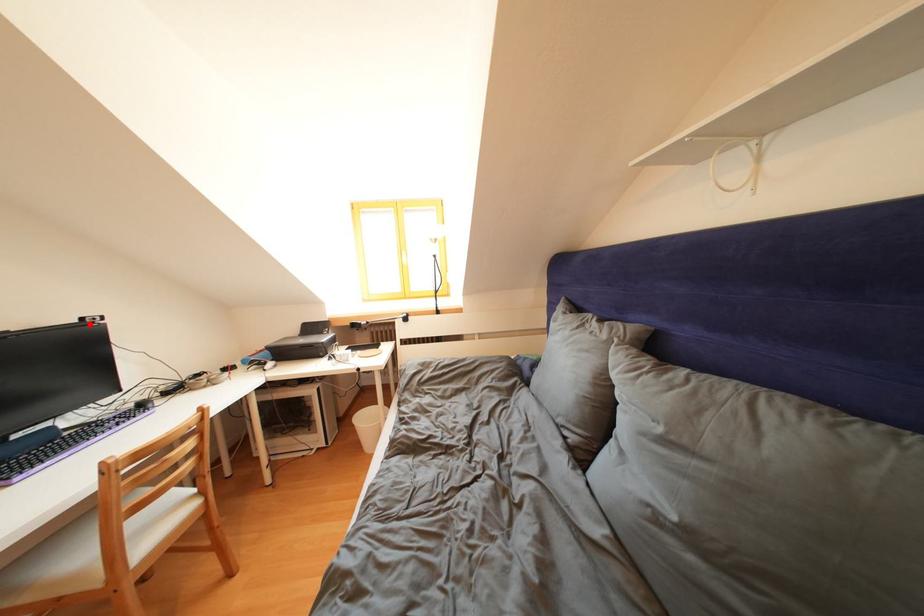
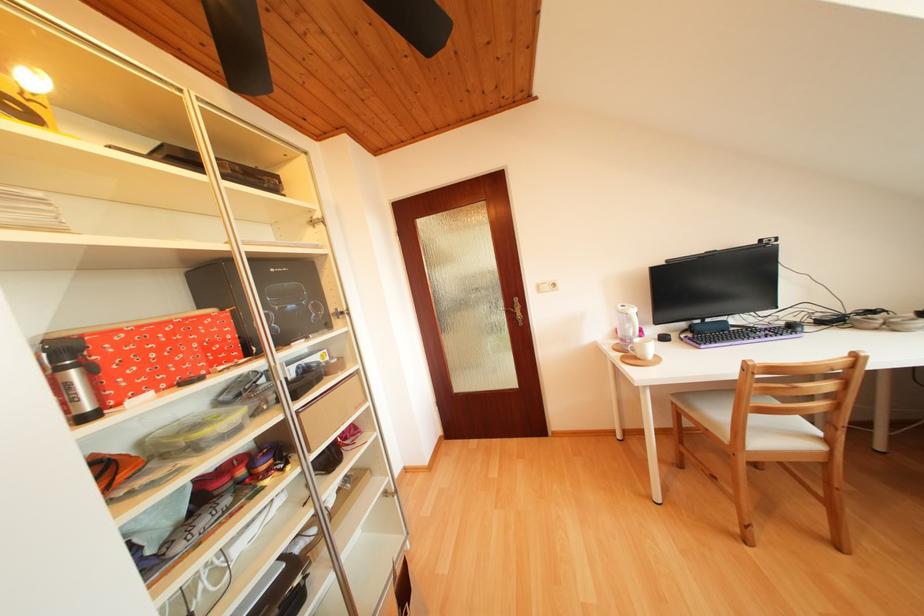
Find the pixel in the second image that matches the highlighted location in the first image.

(769, 246)